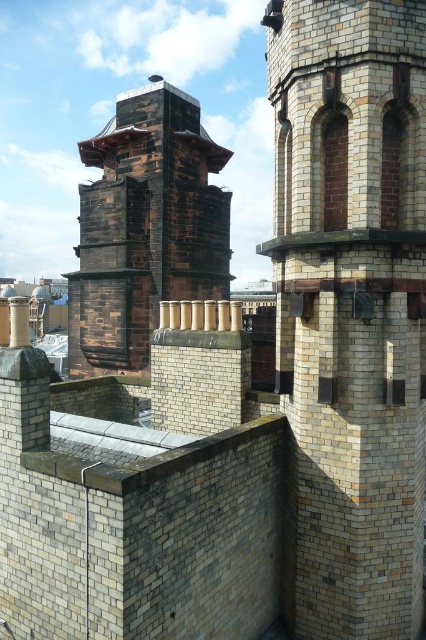
Question: Which point is closer to the camera?

Choices:
 (A) (319, 532)
 (B) (118, 131)

Answer: (A)

Question: Does rustic brick chimney at center appear under shiny metallic roof at upper center?

Choices:
 (A) no
 (B) yes

Answer: (B)

Question: Which point appears farthest from the camera in this image?

Choices:
 (A) (302, 493)
 (B) (69, 305)
 (C) (149, 112)

Answer: (B)

Question: Can you confirm if rustic brick chimney at center is bigger than shiny metallic roof at upper center?

Choices:
 (A) no
 (B) yes

Answer: (B)

Question: Estimate the real-world distances between objects in this image. Which object is closer to the shiny metallic roof at upper center?

Choices:
 (A) white brick tower at center
 (B) rustic brick chimney at center

Answer: (B)

Question: Is the position of rustic brick chimney at center less distant than that of shiny metallic roof at upper center?

Choices:
 (A) yes
 (B) no

Answer: (A)